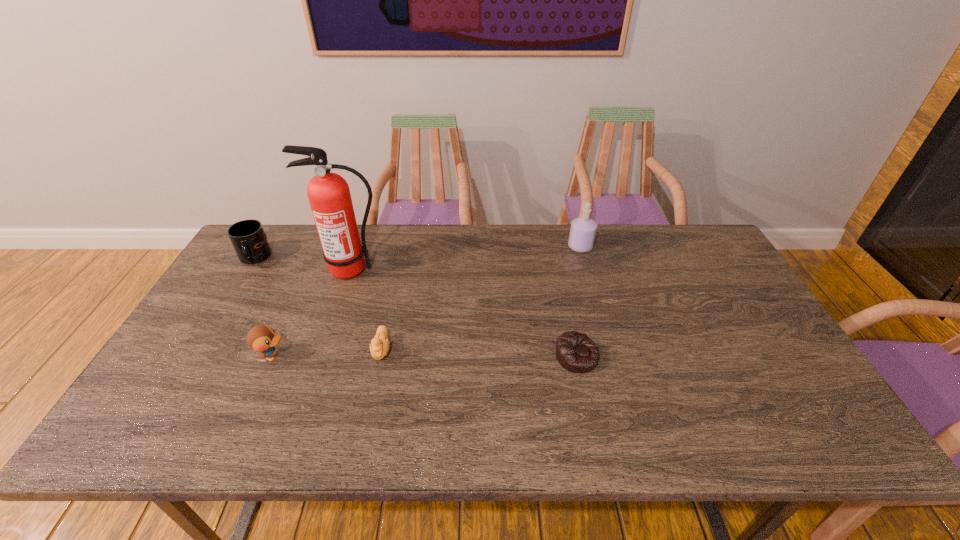
The height and width of the screenshot is (540, 960). Find the location of `fire extinguisher`. fire extinguisher is located at coordinates (329, 196).

Where is `perfume`? perfume is located at coordinates (583, 230).

Where is `mug`? mug is located at coordinates click(248, 238).

Find the location of a particular element. This screenshot has width=960, height=540. duck is located at coordinates (261, 338).

Where is `the second shortest object`? This screenshot has width=960, height=540. the second shortest object is located at coordinates (379, 347).

Find the location of a particular element. The width and height of the screenshot is (960, 540). duckling is located at coordinates [x=379, y=347].

Where is `beanbag`? Image resolution: width=960 pixels, height=540 pixels. beanbag is located at coordinates (576, 352).

Find the location of a particular element. The image size is (960, 540). free space located 0.360m on the handle side of the fire extinguisher is located at coordinates (315, 380).

Locate an element on the screen. vacant point located on the left of the second tallest object is located at coordinates (488, 247).

Find the location of a particular element. The width and height of the screenshot is (960, 540). vacant space located with the handle on the side of the mug is located at coordinates (191, 360).